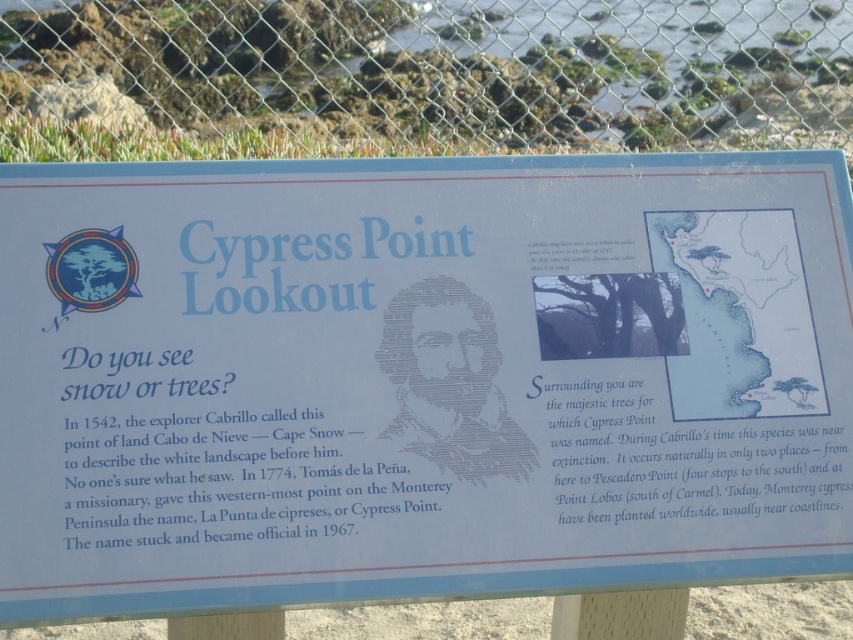
Question: Does white plastic sign at center appear on the left side of green chain-link fence at upper center?

Choices:
 (A) no
 (B) yes

Answer: (A)

Question: Is white plastic sign at center to the left of green chain-link fence at upper center from the viewer's perspective?

Choices:
 (A) no
 (B) yes

Answer: (A)

Question: Is white plastic sign at center positioned before green chain-link fence at upper center?

Choices:
 (A) yes
 (B) no

Answer: (A)

Question: Which object is closer to the camera taking this photo?

Choices:
 (A) white plastic sign at center
 (B) green chain-link fence at upper center

Answer: (A)